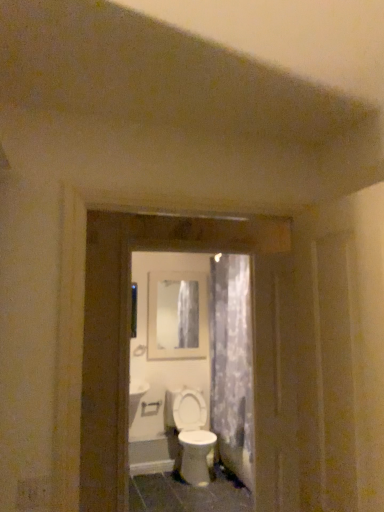
Where is `matte glass mirror at center`? This screenshot has width=384, height=512. matte glass mirror at center is located at coordinates (177, 314).

What do you see at coordinates (177, 314) in the screenshot?
I see `matte glass mirror at center` at bounding box center [177, 314].

This screenshot has height=512, width=384. Describe the element at coordinates (128, 327) in the screenshot. I see `white glossy screen door at center` at that location.

At what (x,y) coordinates should I click in order to perform the action: click on white glossy toilet at center. Please return your answer as a coordinate pair (x, y). Looking at the image, I should click on coord(192,435).

Can you confirm if white glossy toilet at center is positioned to the left of white plastic door handle at center?

No.

Locate an element on the screen. The image size is (384, 512). door handle that appears behind the white glossy toilet at center is located at coordinates (151, 404).

From a real-world perspective, who is located higher, white glossy toilet at center or white plastic door handle at center?

white plastic door handle at center, from a real-world perspective.

Is white glossy toilet at center placed right next to white plastic door handle at center?

They are not placed beside each other.

How many degrees apart are the facing directions of white glossy screen door at center and translucent floral fabric at center?

87 degrees.

From the image's perspective, would you say white glossy screen door at center is shown under translucent floral fabric at center?

Actually, white glossy screen door at center appears above translucent floral fabric at center in the image.

Does white glossy screen door at center have a greater height compared to translucent floral fabric at center?

No, white glossy screen door at center is not taller than translucent floral fabric at center.

Can you confirm if white glossy screen door at center is positioned to the right of translucent floral fabric at center?

No, white glossy screen door at center is not to the right of translucent floral fabric at center.

From the image's perspective, is translucent floral fabric at center over matte glass mirror at center?

No, from the image's perspective, translucent floral fabric at center is not over matte glass mirror at center.

Is the position of translucent floral fabric at center less distant than that of matte glass mirror at center?

Yes, it is.

Which is more to the left, translucent floral fabric at center or matte glass mirror at center?

Positioned to the left is matte glass mirror at center.

Is translucent floral fabric at center facing away from matte glass mirror at center?

translucent floral fabric at center does not have its back to matte glass mirror at center.

From the image's perspective, is matte glass mirror at center located above or below white plastic door handle at center?

matte glass mirror at center is above white plastic door handle at center.

From the picture: Could you tell me if matte glass mirror at center is turned towards white plastic door handle at center?

No, matte glass mirror at center does not turn towards white plastic door handle at center.

In terms of width, does matte glass mirror at center look wider or thinner when compared to white plastic door handle at center?

matte glass mirror at center is thinner than white plastic door handle at center.

Which is closer to the camera, (169,322) or (154,404)?

Point (169,322) appears to be farther away from the viewer than point (154,404).

Considering the positions of points (181, 455) and (287, 249), is point (181, 455) farther from camera compared to point (287, 249)?

That is True.

Which of these two, white glossy toilet at center or white glossy screen door at center, is bigger?

white glossy toilet at center.

How much distance is there between white glossy toilet at center and white glossy screen door at center?

5.90 feet.

Is the surface of white glossy toilet at center in direct contact with white glossy screen door at center?

white glossy toilet at center and white glossy screen door at center are clearly separated.

Are white glossy toilet at center and translucent floral fabric at center making contact?

They are not placed beside each other.

Considering the points (199, 458) and (231, 347), which point is behind, point (199, 458) or point (231, 347)?

Point (231, 347)

Is white glossy toilet at center at the left side of translucent floral fabric at center?

Yes.

Is white glossy toilet at center smaller than translucent floral fabric at center?

Correct, white glossy toilet at center occupies less space than translucent floral fabric at center.

Can you confirm if matte glass mirror at center is thinner than translucent floral fabric at center?

Yes.

Is point (177, 297) positioned behind point (238, 417)?

That is True.

Between matte glass mirror at center and translucent floral fabric at center, which one appears on the right side from the viewer's perspective?

translucent floral fabric at center.

Where is `door handle that appears above the white glossy toilet at center (from the image's perspective)`? door handle that appears above the white glossy toilet at center (from the image's perspective) is located at coordinates (151, 404).

Identify the location of shower curtain located behind the white glossy screen door at center. (232, 362).

Which object lies further to the anchor point matte glass mirror at center, translucent floral fabric at center or white glossy toilet at center?

white glossy toilet at center.

Based on their spatial positions, is white glossy screen door at center or matte glass mirror at center closer to translucent floral fabric at center?

The object closer to translucent floral fabric at center is matte glass mirror at center.

Looking at the image, which one is located further to white plastic door handle at center, translucent floral fabric at center or white glossy screen door at center?

white glossy screen door at center is further to white plastic door handle at center.

Based on their spatial positions, is matte glass mirror at center or white plastic door handle at center closer to white glossy screen door at center?

The object closer to white glossy screen door at center is matte glass mirror at center.

Estimate the real-world distances between objects in this image. Which object is further from white glossy toilet at center, matte glass mirror at center or white glossy screen door at center?

Among the two, white glossy screen door at center is located further to white glossy toilet at center.

From the image, which object appears to be nearer to white glossy toilet at center, translucent floral fabric at center or white glossy screen door at center?

translucent floral fabric at center.

From the image, which object appears to be nearer to matte glass mirror at center, white glossy screen door at center or translucent floral fabric at center?

Among the two, translucent floral fabric at center is located nearer to matte glass mirror at center.

When comparing their distances from white glossy toilet at center, does white glossy screen door at center or matte glass mirror at center seem further?

white glossy screen door at center.

I want to click on toilet between translucent floral fabric at center and white plastic door handle at center along the z-axis, so click(192, 435).

Where is `door handle positioned between white glossy screen door at center and matte glass mirror at center from near to far`? The height and width of the screenshot is (512, 384). door handle positioned between white glossy screen door at center and matte glass mirror at center from near to far is located at coordinates (151, 404).

Identify the location of shower curtain between matte glass mirror at center and white glossy toilet at center vertically. The image size is (384, 512). (232, 362).

You are a GUI agent. You are given a task and a screenshot of the screen. Output one action in this format:
    pyautogui.click(x=<x>, y=<y>)
    Task: Click on the shower curtain between white glossy screen door at center and matte glass mirror at center from front to back
    The image size is (384, 512).
    Given the screenshot: What is the action you would take?
    pyautogui.click(x=232, y=362)